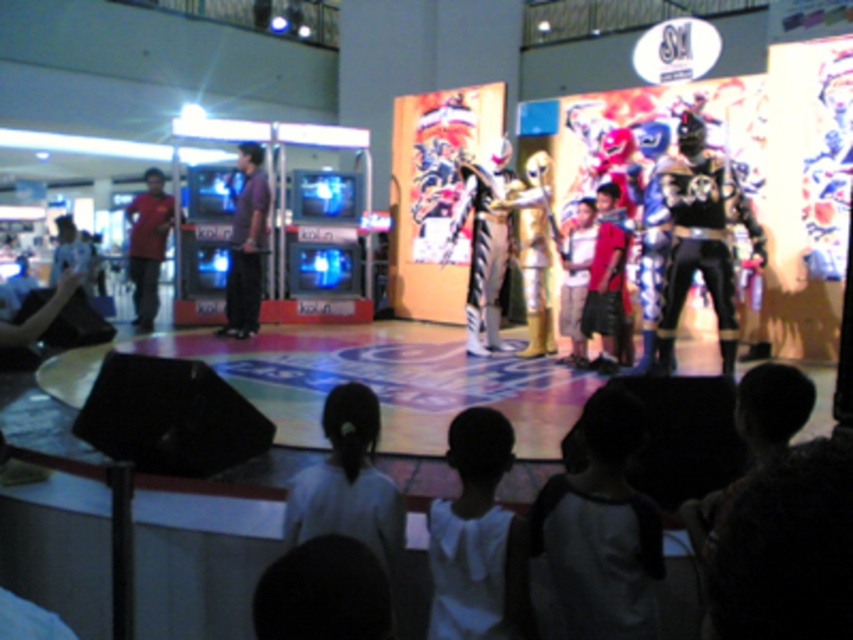
Does black metallic armor at center have a lesser height compared to purple shirt at left?

Yes, black metallic armor at center is shorter than purple shirt at left.

Describe the element at coordinates (701, 237) in the screenshot. I see `black metallic armor at center` at that location.

Between point (705, 196) and point (258, 276), which one is positioned in front?

Point (705, 196)

At what (x,y) coordinates should I click in order to perform the action: click on black metallic armor at center. Please return your answer as a coordinate pair (x, y). The image size is (853, 640). Looking at the image, I should click on (701, 237).

Image resolution: width=853 pixels, height=640 pixels. What do you see at coordinates (479, 540) in the screenshot? I see `white fabric shirt at lower center` at bounding box center [479, 540].

Does point (524, 579) come in front of point (679, 310)?

Yes, it is in front of point (679, 310).

Which is in front, point (466, 433) or point (729, 340)?

Point (466, 433) is more forward.

Find the location of a particular element. This screenshot has height=640, width=853. white fabric shirt at lower center is located at coordinates (479, 540).

Does purple shirt at left have a greater width compared to matte red shirt at left?

No.

Who is shorter, purple shirt at left or matte red shirt at left?

purple shirt at left is shorter.

Is point (233, 225) farther from camera compared to point (131, 212)?

No.

Where is `purple shirt at left`? The image size is (853, 640). purple shirt at left is located at coordinates (247, 246).